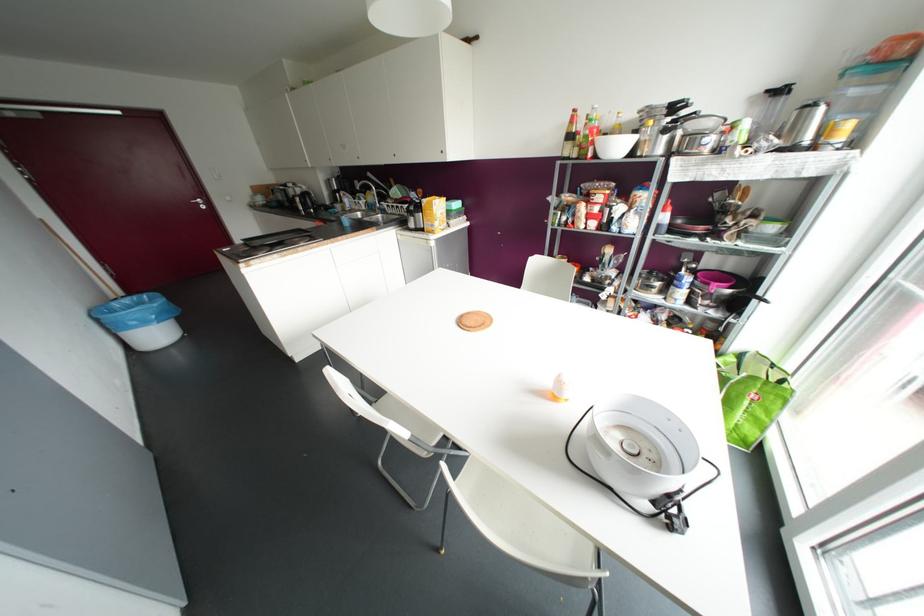
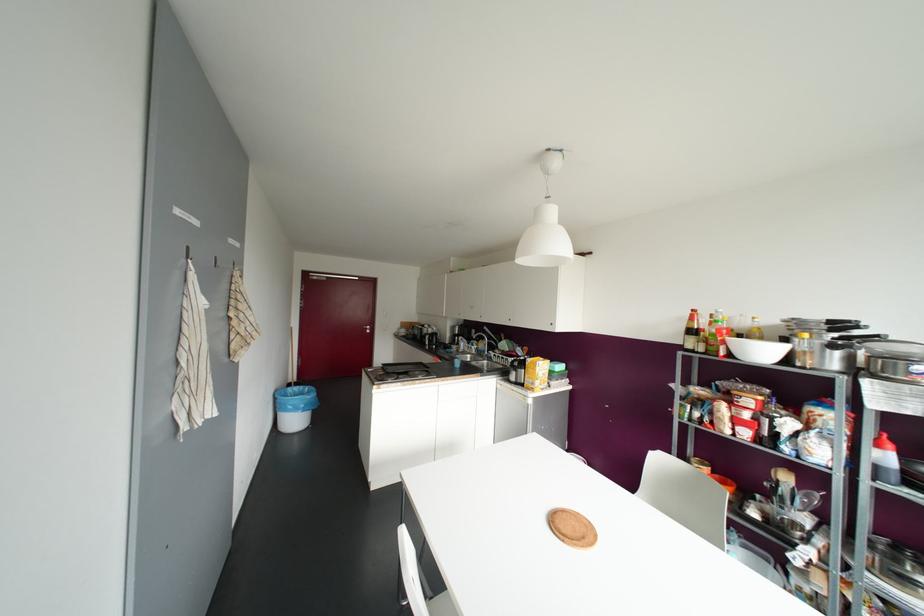
First-person continuous shooting, in which direction is the camera rotating?

The camera rotated toward left-up.